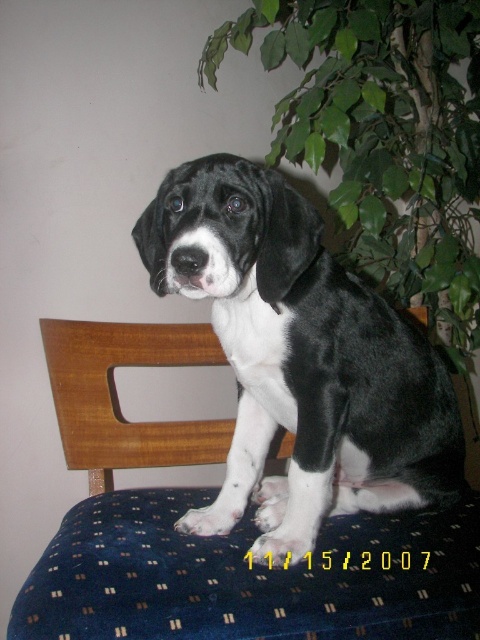
You are a photographer setting up a shot of the wooden chair at center and the green leafy plant at upper right. Which object is positioned closer to your camera lens?

The wooden chair at center is closer to the viewer than the green leafy plant at upper right, so the wooden chair at center is positioned closer to the camera lens.